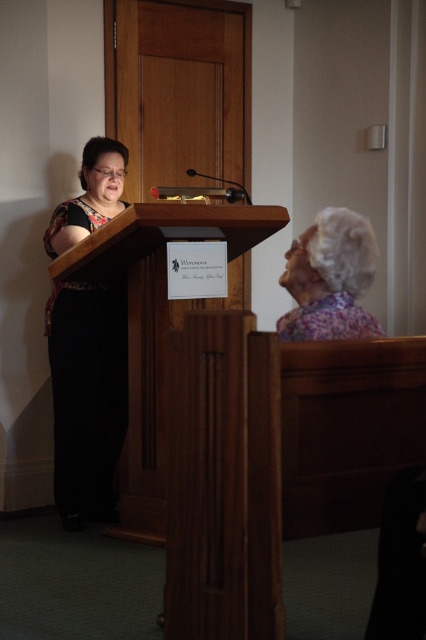
You are an event planner organizing a photoshoot. You need to position a model wearing a floral fabric dress at left and another wearing a floral fabric headscarf at upper right. Based on the scene, which of the two items is closer to the camera?

The floral fabric dress at left is closer to the camera because the floral fabric headscarf at upper right is positioned behind it.

Based on the photo, you are organizing an event and need to place a large banner behind the wooden podium at center and the floral fabric headscarf at upper right. Which object requires a larger space for the banner?

The wooden podium at center requires a larger space for the banner since it is bigger than the floral fabric headscarf at upper right.